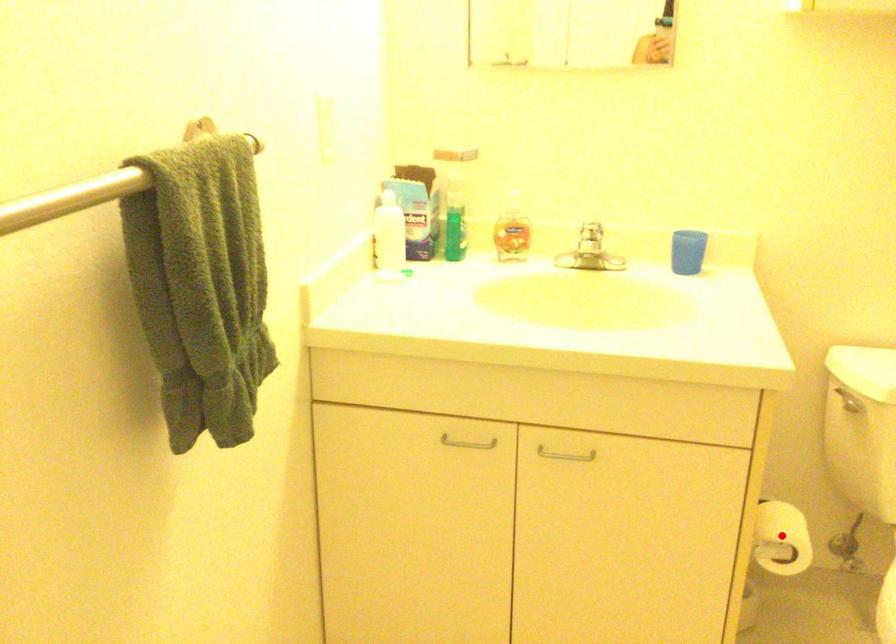
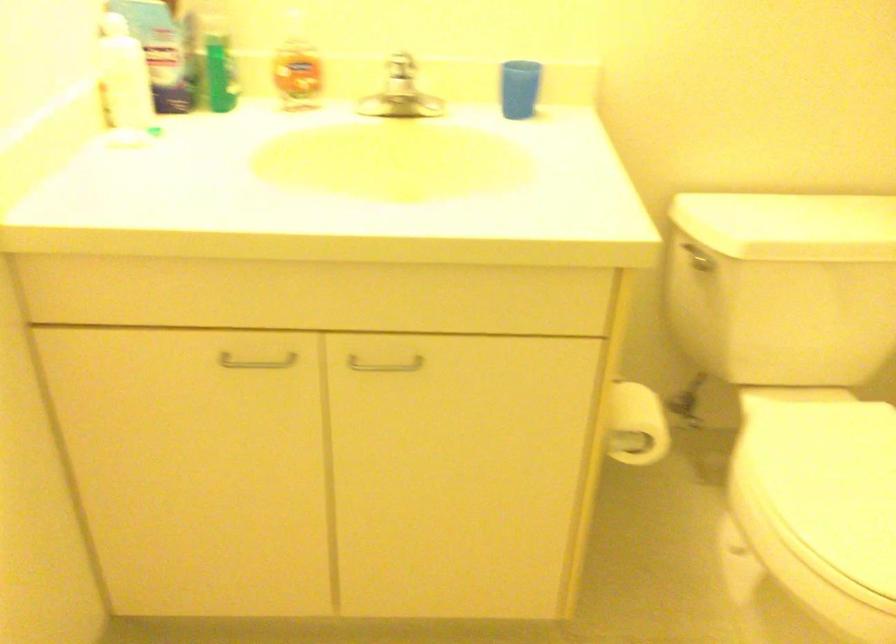
Question: I am providing you with two images of the same scene from different viewpoints. In image1, a red point is highlighted. Considering the same 3D point in image2, which of the following is correct?

Choices:
 (A) It is closer
 (B) It is farther

Answer: (A)